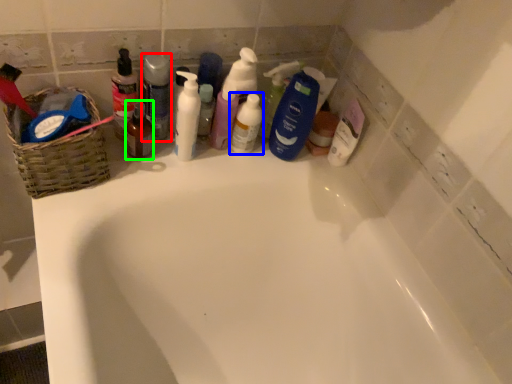
Question: Based on their relative distances, which object is nearer to cleaning product (highlighted by a red box)? Choose from cleaning product (highlighted by a blue box) and mouthwash (highlighted by a green box).

Choices:
 (A) cleaning product
 (B) mouthwash

Answer: (B)